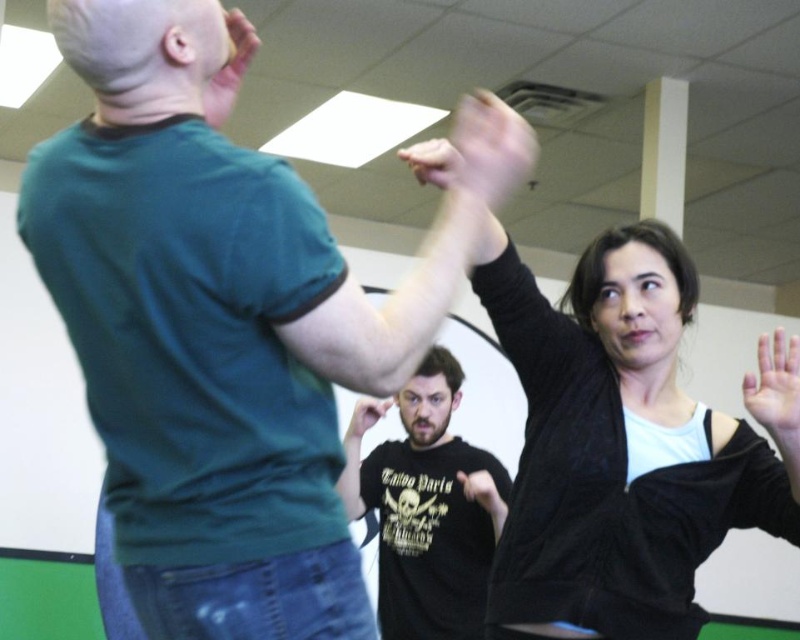
You are observing a martial arts training session. There are two hands in the center of the image, a black matte hand at center and a matte black hand at center. Which hand is located to the right of the other?

The black matte hand at center is positioned on the right side of the matte black hand at center.

Consider the image. You are a photographer setting up a shoot in the studio. You want to ensure that the black matte jacket at upper right and the smooth skin hand at upper right are both in focus. Which object should you adjust the camera focus to prioritize for a sharp image of both?

The black matte jacket at upper right is closer to the viewer than the smooth skin hand at upper right. To ensure both are in focus, the photographer should focus on the farther object, the smooth skin hand at upper right, as the depth of field will naturally include the closer object in focus as well.

You are standing in the training room and want to move from point A to point B. Point A is at coordinate point[780,372] and point B is at coordinate point[360,440]. Which point is closer to you when you first enter the room?

Point[780,372] is closer to the viewer than point[360,440], so point A is closer to you when you first enter the room.